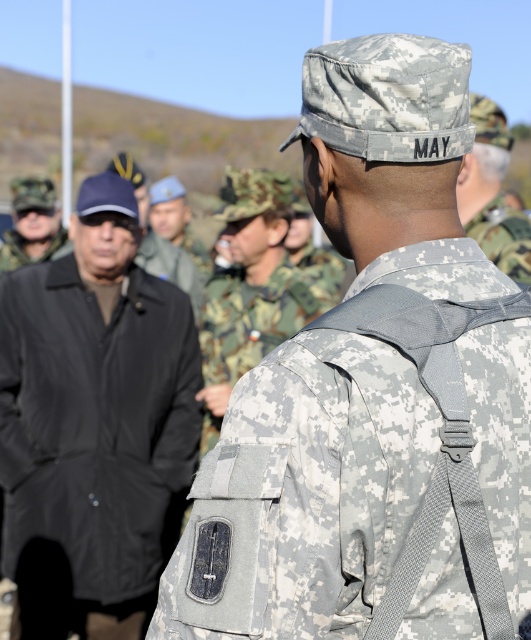
You are a photographer trying to capture a clear shot of the camouflage fabric backpack at center and the matte black jacket at left. Since the backpack is shorter than the jacket, will the backpack be fully visible in the photo if the jacket is in the foreground?

The camouflage fabric backpack at center is not as tall as matte black jacket at left. Since the backpack is shorter, if the matte black jacket at left is in the foreground, it might block part of the backpack, making it less visible. Adjust your angle to ensure both are fully visible.

You are a photographer trying to capture a detailed shot of the two points in the image. Which point, point (19, 481) or point (21, 189), would appear larger in your photo?

Point (19, 481) is closer to the camera than point (21, 189), so it would appear larger in the photo.